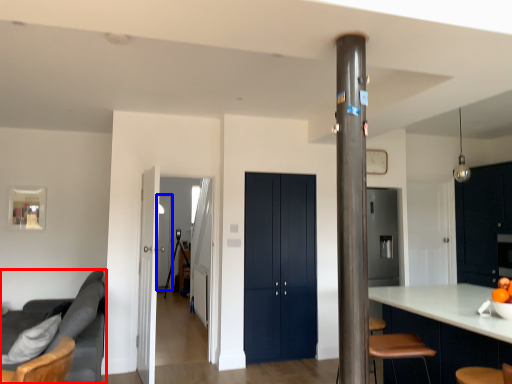
Question: Which object is further to the camera taking this photo, studio couch (highlighted by a red box) or glass door (highlighted by a blue box)?

Choices:
 (A) studio couch
 (B) glass door

Answer: (B)